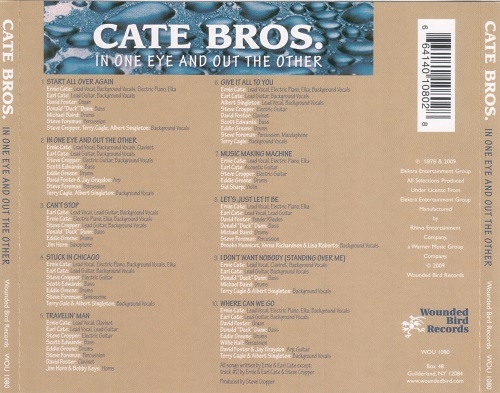
What are the coordinates of `album` in the screenshot? It's located at (161, 59).